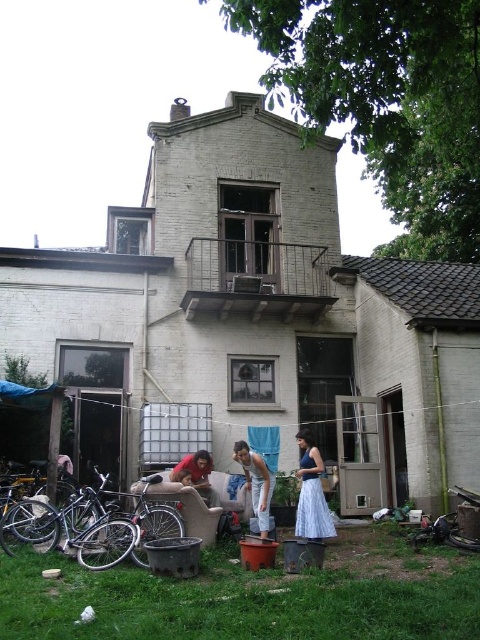
Which of these two, matte brown pot at lower center or shiny black bicycle at lower left, stands taller?

With more height is shiny black bicycle at lower left.

This screenshot has height=640, width=480. Describe the element at coordinates (253, 596) in the screenshot. I see `matte brown pot at lower center` at that location.

You are a GUI agent. You are given a task and a screenshot of the screen. Output one action in this format:
    pyautogui.click(x=<x>, y=<y>)
    Task: Click on the matte brown pot at lower center
    The width and height of the screenshot is (480, 640).
    Given the screenshot: What is the action you would take?
    pyautogui.click(x=253, y=596)

Does matte brown pot at lower center have a lesser width compared to matte red shirt at center?

In fact, matte brown pot at lower center might be wider than matte red shirt at center.

From the picture: Who is higher up, matte brown pot at lower center or matte red shirt at center?

matte red shirt at center is above.

Where is `matte brown pot at lower center`? The height and width of the screenshot is (640, 480). matte brown pot at lower center is located at coordinates (253, 596).

What do you see at coordinates (124, 529) in the screenshot?
I see `silver metallic bicycle at lower left` at bounding box center [124, 529].

Between point (78, 557) and point (193, 486), which one is positioned in front?

Point (78, 557) is in front.

Identify the location of silver metallic bicycle at lower left. (124, 529).

You are a GUI agent. You are given a task and a screenshot of the screen. Output one action in this format:
    pyautogui.click(x=<x>, y=<y>)
    Task: Click on the silver metallic bicycle at lower left
    Image resolution: width=480 pixels, height=640 pixels.
    Given the screenshot: What is the action you would take?
    pyautogui.click(x=124, y=529)